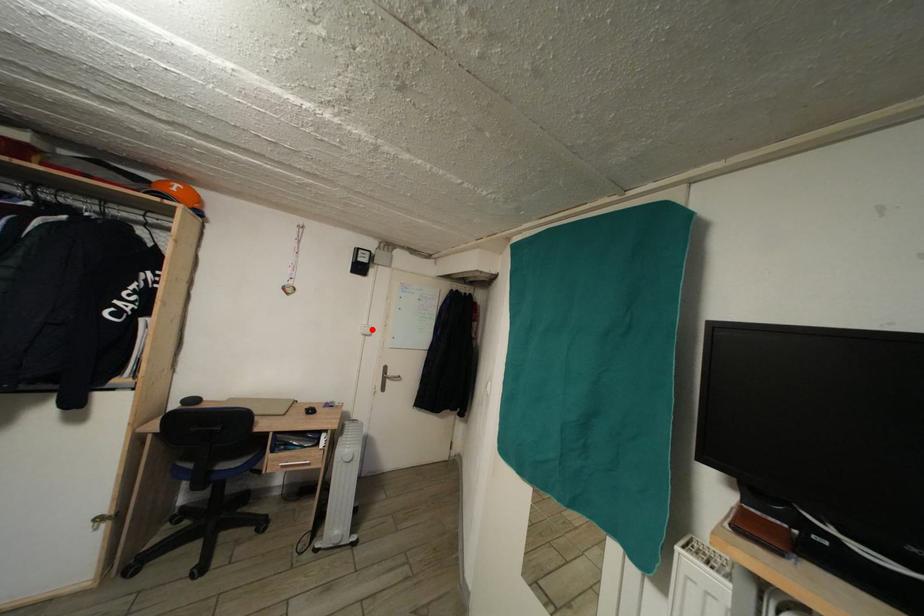
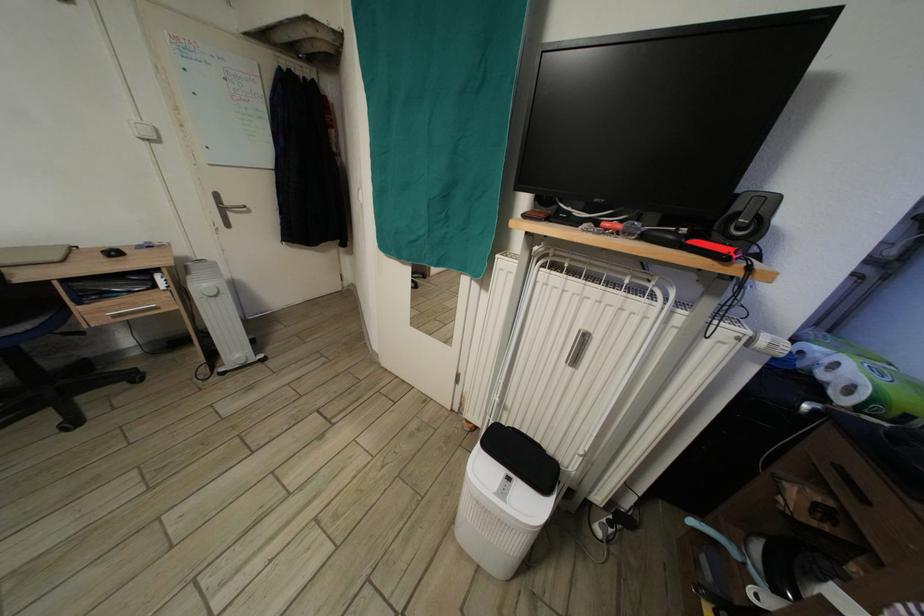
In the second image, find the point that corresponds to the highlighted location in the first image.

(141, 124)